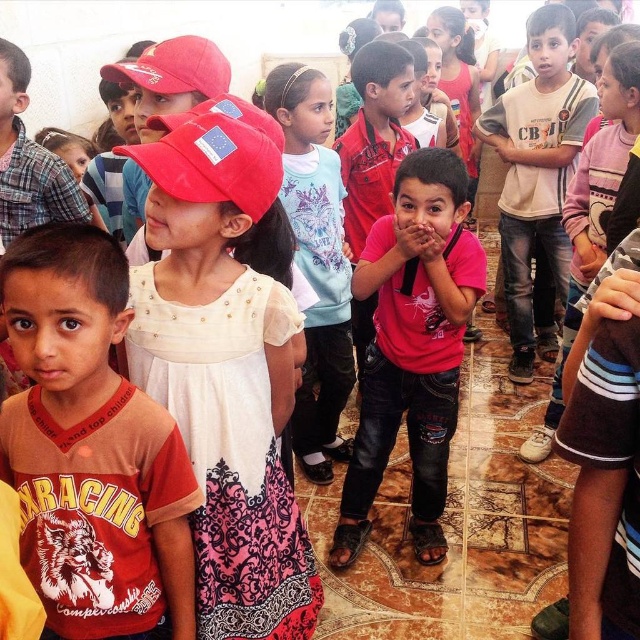
Question: Which point is farther to the camera?

Choices:
 (A) matte red t-shirt at left
 (B) pink matte shirt at center

Answer: (B)

Question: Is matte red t-shirt at left in front of pink matte shirt at center?

Choices:
 (A) yes
 (B) no

Answer: (A)

Question: Which point is closer to the camera?

Choices:
 (A) (371, 467)
 (B) (19, 300)

Answer: (B)

Question: Does matte red t-shirt at left appear on the right side of pink matte shirt at center?

Choices:
 (A) yes
 (B) no

Answer: (B)

Question: Can you confirm if matte red t-shirt at left is wider than pink matte shirt at center?

Choices:
 (A) no
 (B) yes

Answer: (A)